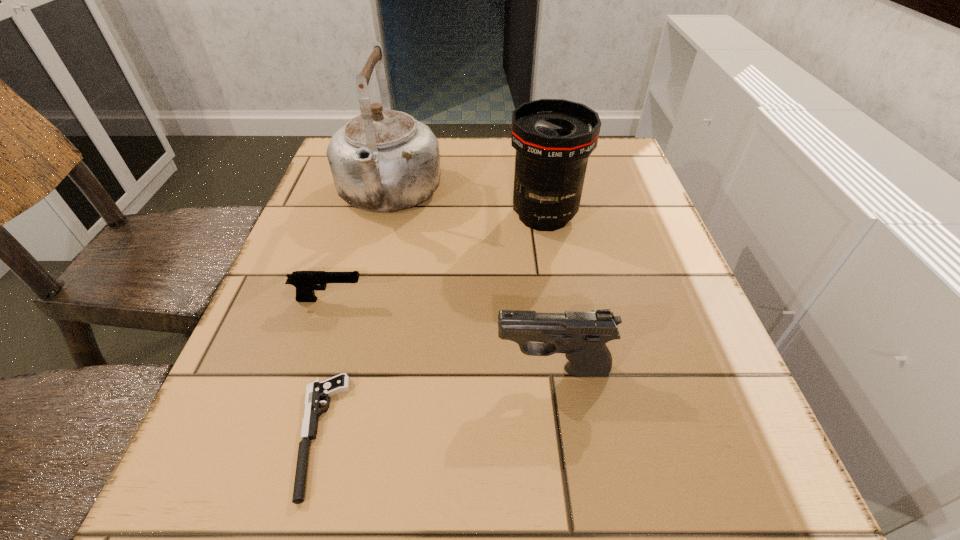
Identify which object is located as the third nearest to the tallest object. Please provide its 2D coordinates. Your answer should be formatted as a tuple, i.e. [(x, y)], where the tuple contains the x and y coordinates of a point satisfying the conditions above.

[(581, 335)]

Locate an element on the screen. pistol that is the closest to the second tallest pistol is located at coordinates (317, 390).

Identify which pistol is located as the nearest to the farthest pistol. Please provide its 2D coordinates. Your answer should be formatted as a tuple, i.e. [(x, y)], where the tuple contains the x and y coordinates of a point satisfying the conditions above.

[(317, 390)]

Where is `blank space that satisfies the following two spatial constraints: 1. at the spout of the kettle; 2. on the left side of the second tallest object`? This screenshot has width=960, height=540. blank space that satisfies the following two spatial constraints: 1. at the spout of the kettle; 2. on the left side of the second tallest object is located at coordinates (383, 215).

Where is `vacant area that satisfies the following two spatial constraints: 1. on the front side of the telephoto lens; 2. on the front-facing side of the shortest pistol`? The width and height of the screenshot is (960, 540). vacant area that satisfies the following two spatial constraints: 1. on the front side of the telephoto lens; 2. on the front-facing side of the shortest pistol is located at coordinates [x=581, y=435].